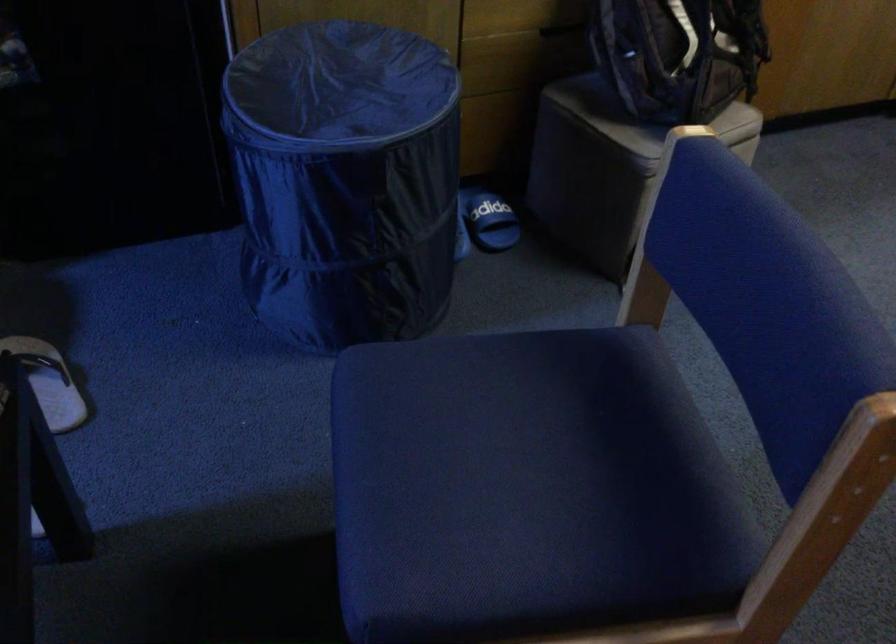
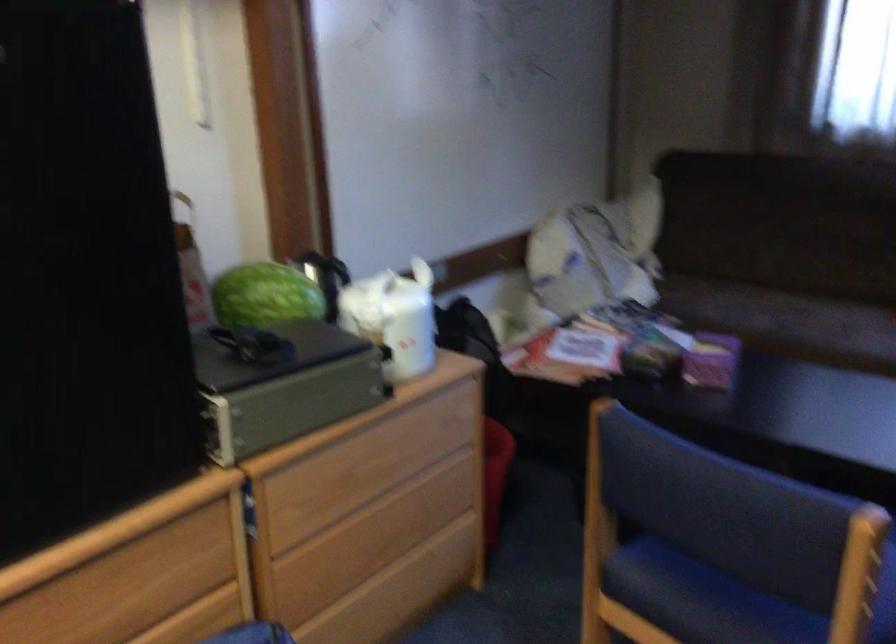
Find the pixel in the second image that matches (668,200) in the first image.

(858, 574)